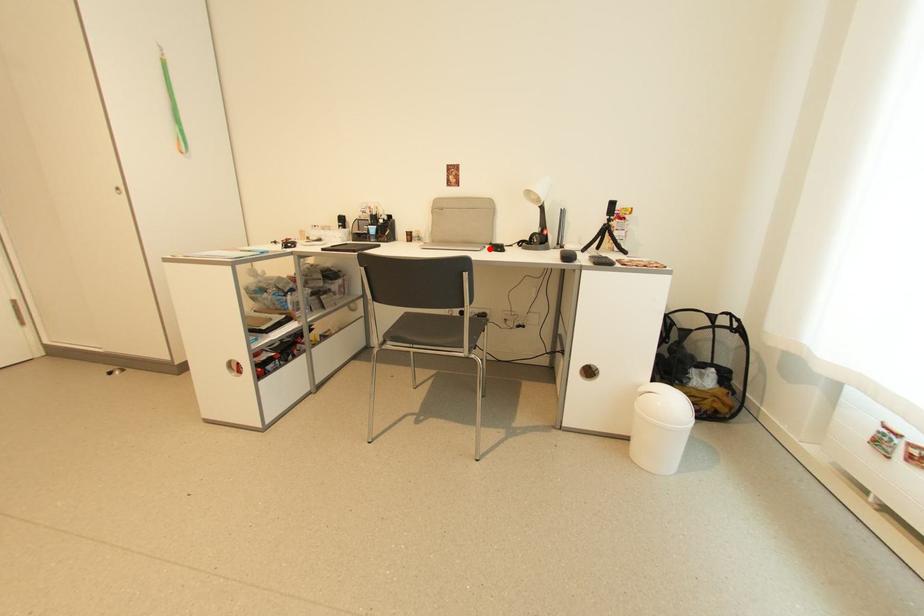
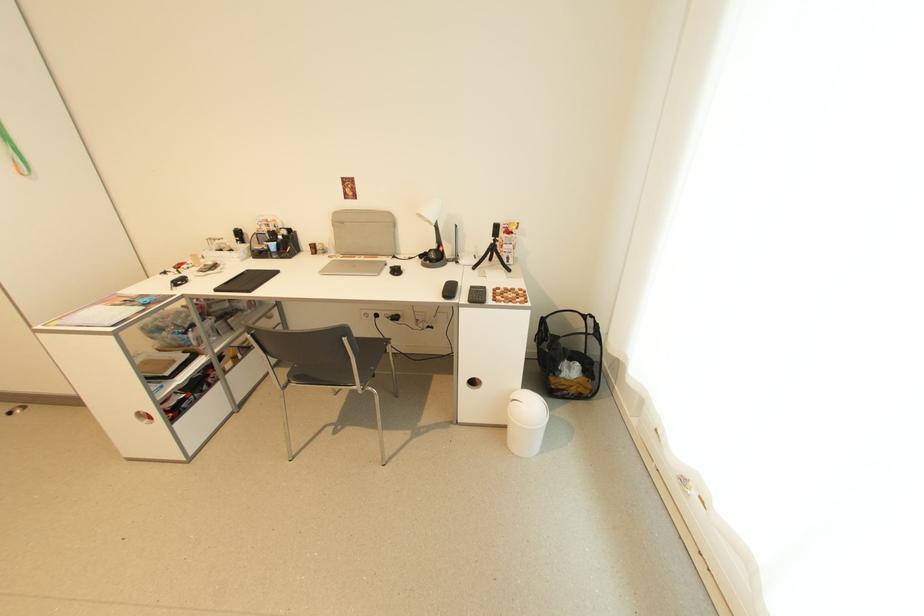
Locate, in the second image, the point that corresponds to the highlighted location in the first image.

(391, 265)